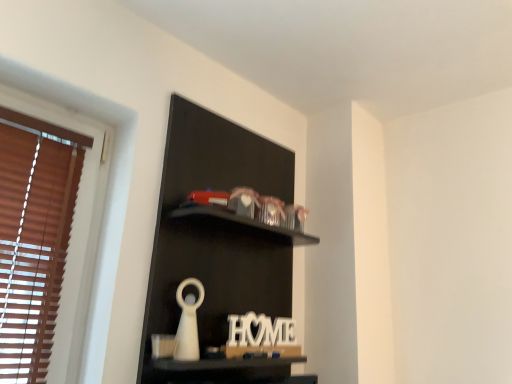
Question: In the image, is black matte shelf at upper center positioned in front of or behind white wood letter at center?

Choices:
 (A) front
 (B) behind

Answer: (A)

Question: From a real-world perspective, is black matte shelf at upper center above or below white wood letter at center?

Choices:
 (A) below
 (B) above

Answer: (B)

Question: Is black matte shelf at upper center wider or thinner than white wood letter at center?

Choices:
 (A) wide
 (B) thin

Answer: (A)

Question: From a real-world perspective, is white wood letter at center positioned above or below black matte shelf at upper center?

Choices:
 (A) above
 (B) below

Answer: (B)

Question: From the image's perspective, is white wood letter at center positioned above or below black matte shelf at upper center?

Choices:
 (A) above
 (B) below

Answer: (B)

Question: Considering the positions of point (257, 329) and point (178, 153), is point (257, 329) closer or farther from the camera than point (178, 153)?

Choices:
 (A) closer
 (B) farther

Answer: (B)

Question: Choose the correct answer: Is white wood letter at center inside black matte shelf at upper center or outside it?

Choices:
 (A) outside
 (B) inside

Answer: (B)